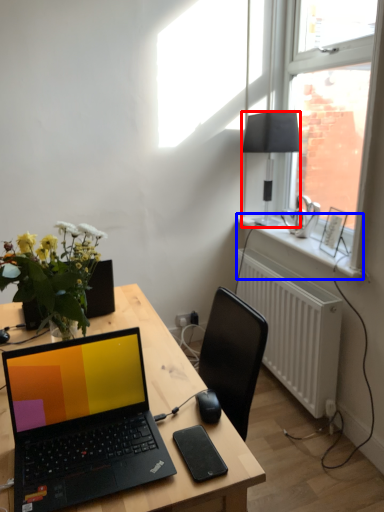
Question: Which point is closer to the camera, lamp (highlighted by a red box) or window sill (highlighted by a blue box)?

Choices:
 (A) lamp
 (B) window sill

Answer: (B)